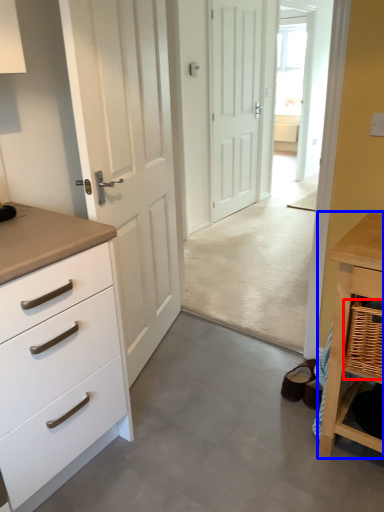
Question: Which object is closer to the camera taking this photo, basket (highlighted by a red box) or table (highlighted by a blue box)?

Choices:
 (A) basket
 (B) table

Answer: (A)